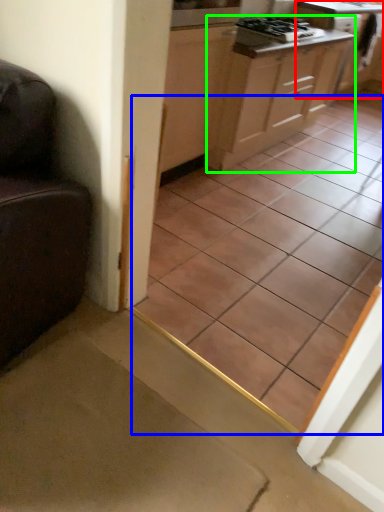
Question: Which object is the closest to the cabinetry (highlighted by a red box)? Choose among these: ceramic tile (highlighted by a blue box) or cabinetry (highlighted by a green box).

Choices:
 (A) ceramic tile
 (B) cabinetry

Answer: (B)